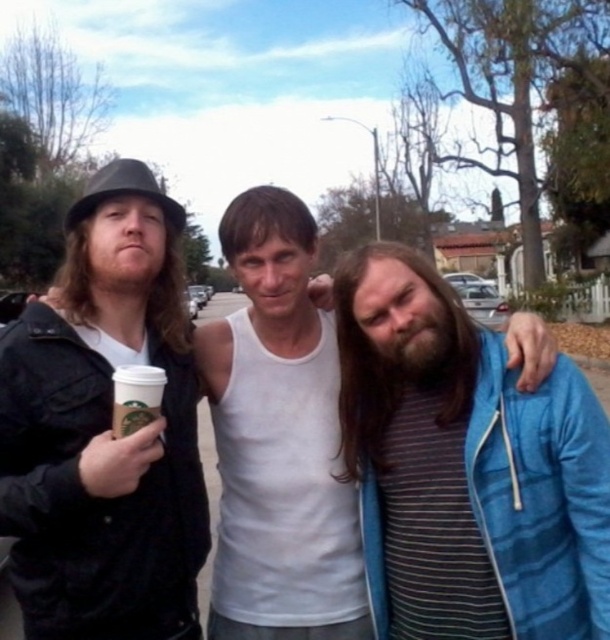
You are a photographer trying to capture a candid shot of the two people in the scene. The black matte hat at upper left and the white cotton tank top at center are both in your viewfinder. Since you want to focus on the person in the middle, which object should you adjust your camera to prioritize in the frame?

The white cotton tank top at center should be prioritized in the frame because it is the person in the middle you want to focus on, and the black matte hat at upper left belongs to the person on the left.

From the picture: You are a photographer trying to capture a group photo of the black matte hat at upper left and the white cotton tank top at center. The camera you are using has a minimum focusing distance of 12 inches. Will you be able to take a clear photo of both subjects without moving either of them?

The black matte hat at upper left is 13.51 inches away from the white cotton tank top at center. Since the camera requires a minimum focusing distance of 12 inches, the distance between them is sufficient for both subjects to be in focus without needing to move.

You are a delivery person trying to hand a package to the person holding the white paper cup at center. To avoid blocking the path of the person wearing the striped cotton shirt at center, which is to the right of the cup, should you approach from the left or right side of the cup holder?

You should approach from the left side of the white paper cup at center because the striped cotton shirt at center is to the right of it, so moving to the right might block their path.